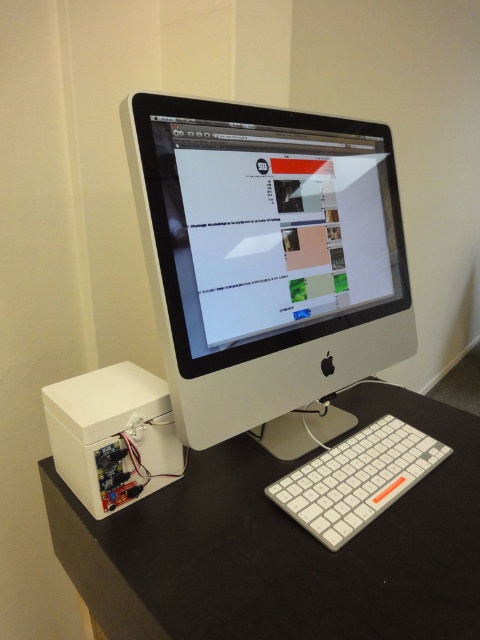
Does white plastic computer monitor at center have a larger size compared to white matte/black plastic computer desk at lower left?

No.

Can you confirm if white plastic computer monitor at center is positioned below white matte/black plastic computer desk at lower left?

Actually, white plastic computer monitor at center is above white matte/black plastic computer desk at lower left.

Does point (255, 296) come closer to viewer compared to point (367, 566)?

No, (255, 296) is behind (367, 566).

The image size is (480, 640). I want to click on white plastic computer monitor at center, so click(268, 264).

Between white plastic computer monitor at center and white plastic keyboard at lower right, which one has less height?

white plastic keyboard at lower right is shorter.

Which is above, white plastic computer monitor at center or white plastic keyboard at lower right?

Positioned higher is white plastic computer monitor at center.

The width and height of the screenshot is (480, 640). Describe the element at coordinates (268, 264) in the screenshot. I see `white plastic computer monitor at center` at that location.

Locate an element on the screen. The image size is (480, 640). white plastic computer monitor at center is located at coordinates (268, 264).

Does white matte/black plastic computer desk at lower left come behind white plastic keyboard at lower right?

No, it is in front of white plastic keyboard at lower right.

Which is below, white matte/black plastic computer desk at lower left or white plastic keyboard at lower right?

Positioned lower is white matte/black plastic computer desk at lower left.

Identify the location of white matte/black plastic computer desk at lower left. (283, 547).

Locate an element on the screen. white matte/black plastic computer desk at lower left is located at coordinates (283, 547).